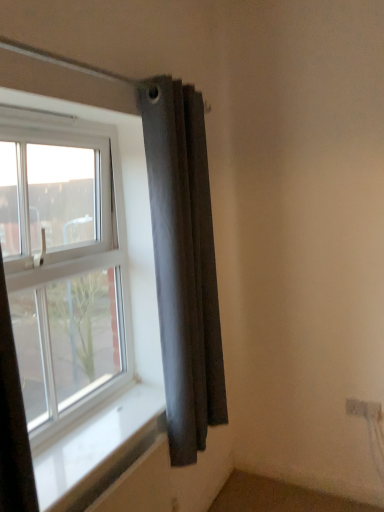
This screenshot has height=512, width=384. Identify the location of dark gray fabric curtain at upper right. (184, 264).

Image resolution: width=384 pixels, height=512 pixels. What do you see at coordinates (64, 262) in the screenshot?
I see `white plastic window at upper left` at bounding box center [64, 262].

Identify the location of dark gray fabric curtain at upper right. (184, 264).

Is point (80, 472) behind point (186, 343)?

That is False.

Between white smooth window sill at lower left and dark gray fabric curtain at upper right, which one is positioned in front?

Positioned in front is white smooth window sill at lower left.

Locate an element on the screen. window sill lying in front of the dark gray fabric curtain at upper right is located at coordinates (93, 441).

From a real-world perspective, is white smooth window sill at lower left physically located above or below dark gray fabric curtain at upper right?

In terms of real-world spatial position, white smooth window sill at lower left is below dark gray fabric curtain at upper right.

Would you say white plastic window at upper left is outside white smooth window sill at lower left?

Indeed, white plastic window at upper left is completely outside white smooth window sill at lower left.

Is white plastic window at upper left shorter than white smooth window sill at lower left?

Incorrect, the height of white plastic window at upper left does not fall short of that of white smooth window sill at lower left.

There is a white smooth window sill at lower left. At what (x,y) coordinates should I click in order to perform the action: click on window above it (from a real-world perspective). Please return your answer as a coordinate pair (x, y). The image size is (384, 512). Looking at the image, I should click on (64, 262).

Is white plastic window at upper left in front of or behind white smooth window sill at lower left in the image?

In the image, white plastic window at upper left appears behind white smooth window sill at lower left.

This screenshot has height=512, width=384. Find the location of `curtain that appears below the white plastic window at upper left (from the image's perspective)`. curtain that appears below the white plastic window at upper left (from the image's perspective) is located at coordinates (184, 264).

Which is closer to the camera, (96,359) or (193,400)?

Point (96,359) appears to be farther away from the viewer than point (193,400).

From a real-world perspective, relative to dark gray fabric curtain at upper right, is white plastic window at upper left vertically above or below?

Clearly, from a real-world perspective, white plastic window at upper left is above dark gray fabric curtain at upper right.

Would you say dark gray fabric curtain at upper right is part of white plastic window at upper left's contents?

No, dark gray fabric curtain at upper right is not surrounded by white plastic window at upper left.

Is dark gray fabric curtain at upper right in contact with white smooth window sill at lower left?

There is a gap between dark gray fabric curtain at upper right and white smooth window sill at lower left.

Considering their positions, is dark gray fabric curtain at upper right located in front of or behind white smooth window sill at lower left?

dark gray fabric curtain at upper right is positioned farther from the viewer than white smooth window sill at lower left.

Which of these two, dark gray fabric curtain at upper right or white smooth window sill at lower left, stands shorter?

Standing shorter between the two is white smooth window sill at lower left.

The height and width of the screenshot is (512, 384). Identify the location of window sill lying on the left of dark gray fabric curtain at upper right. (93, 441).

Would you say dark gray fabric curtain at upper right is to the left or to the right of white plastic window at upper left in the picture?

Based on their positions, dark gray fabric curtain at upper right is located to the right of white plastic window at upper left.

Does dark gray fabric curtain at upper right have a greater width compared to white plastic window at upper left?

Yes, dark gray fabric curtain at upper right is wider than white plastic window at upper left.

Is point (171, 384) closer to viewer compared to point (59, 231)?

No, (171, 384) is behind (59, 231).

The height and width of the screenshot is (512, 384). I want to click on window sill on the right of white plastic window at upper left, so coord(93,441).

Considering the sizes of white smooth window sill at lower left and white plastic window at upper left in the image, is white smooth window sill at lower left bigger or smaller than white plastic window at upper left?

white smooth window sill at lower left is smaller than white plastic window at upper left.

Is point (90, 460) in front of point (45, 255)?

Yes, it is.

Locate an element on the screen. Image resolution: width=384 pixels, height=512 pixels. curtain behind the white smooth window sill at lower left is located at coordinates (184, 264).

Identify the location of window sill that is in front of the white plastic window at upper left. The width and height of the screenshot is (384, 512). (93, 441).

Based on their spatial positions, is white smooth window sill at lower left or dark gray fabric curtain at upper right further from white plastic window at upper left?

white smooth window sill at lower left is positioned further to the anchor white plastic window at upper left.

Looking at the image, which one is located closer to white plastic window at upper left, dark gray fabric curtain at upper right or white smooth window sill at lower left?

The object closer to white plastic window at upper left is dark gray fabric curtain at upper right.

Estimate the real-world distances between objects in this image. Which object is further from white smooth window sill at lower left, dark gray fabric curtain at upper right or white plastic window at upper left?

dark gray fabric curtain at upper right.

Looking at the image, which one is located further to dark gray fabric curtain at upper right, white plastic window at upper left or white smooth window sill at lower left?

white smooth window sill at lower left is further to dark gray fabric curtain at upper right.

Looking at the image, which one is located further to white smooth window sill at lower left, white plastic window at upper left or dark gray fabric curtain at upper right?

dark gray fabric curtain at upper right lies further to white smooth window sill at lower left than the other object.

Based on their spatial positions, is white smooth window sill at lower left or white plastic window at upper left closer to dark gray fabric curtain at upper right?

Based on the image, white plastic window at upper left appears to be nearer to dark gray fabric curtain at upper right.

I want to click on curtain between white plastic window at upper left and white smooth window sill at lower left in the up-down direction, so click(x=184, y=264).